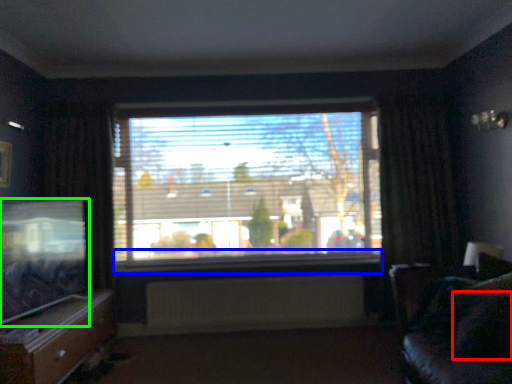
Question: Which object is positioned farthest from pillow (highlighted by a red box)? Select from window sill (highlighted by a blue box) and television (highlighted by a green box).

Choices:
 (A) window sill
 (B) television

Answer: (B)